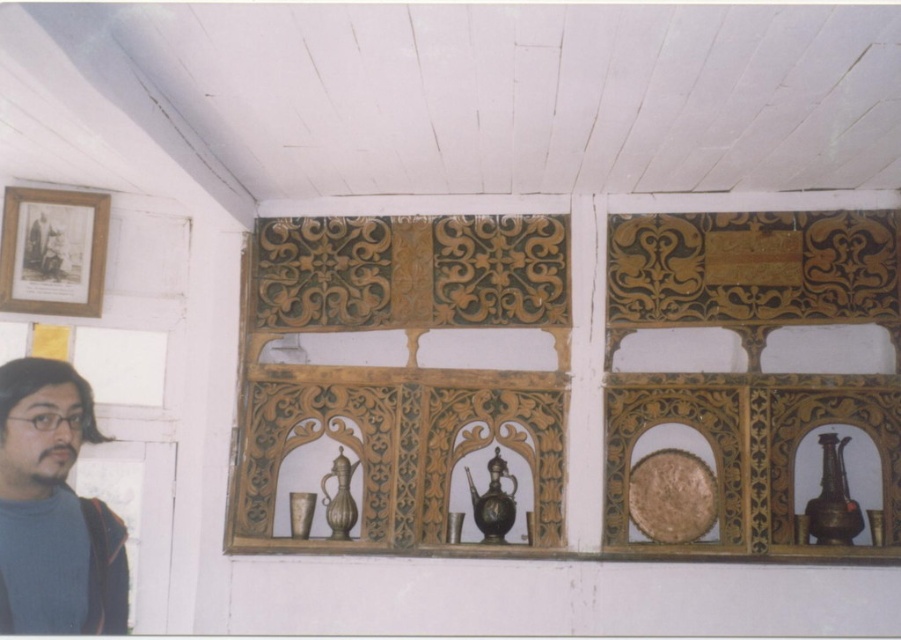
Question: Which object appears closest to the camera in this image?

Choices:
 (A) shiny brass vase at center
 (B) shiny bronze vase at center

Answer: (A)

Question: Estimate the real-world distances between objects in this image. Which object is closer to the bronze metallic vase at right?

Choices:
 (A) shiny bronze vase at center
 (B) matte blue sweater at lower left
 (C) shiny brass vase at center

Answer: (C)

Question: Does shiny brass vase at center appear under shiny bronze vase at center?

Choices:
 (A) yes
 (B) no

Answer: (A)

Question: Which point is closer to the camera taking this photo?

Choices:
 (A) pyautogui.click(x=508, y=499)
 (B) pyautogui.click(x=86, y=419)

Answer: (A)

Question: Is bronze metallic vase at right positioned behind shiny brass vase at center?

Choices:
 (A) yes
 (B) no

Answer: (B)

Question: Can you confirm if matte blue sweater at lower left is thinner than shiny brass vase at center?

Choices:
 (A) yes
 (B) no

Answer: (B)